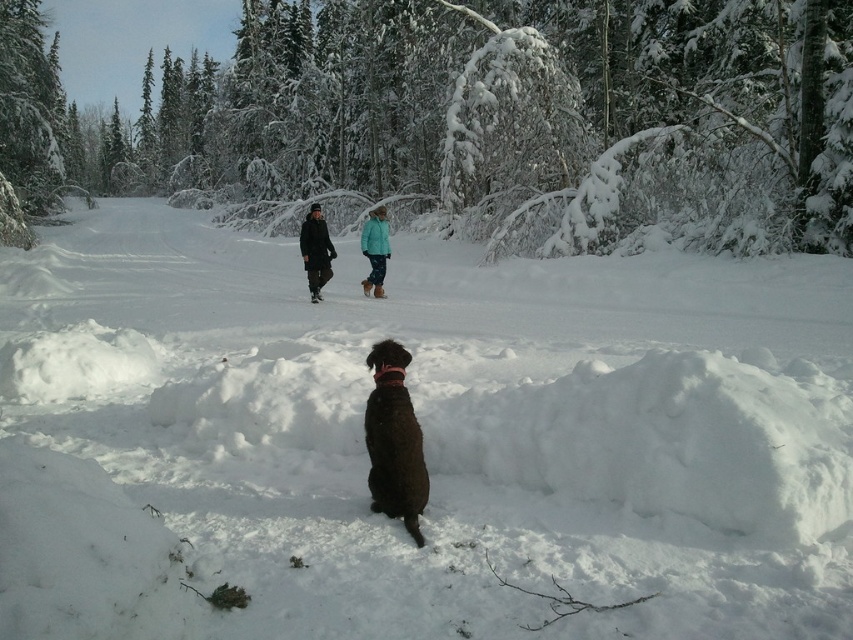
Looking at this image, you are planning to build a snowman using the white fluffy snow at center and the dark brown coat at center. Which object can you use to make the snowman?

The white fluffy snow at center can be used to make the snowman since it is bigger than the dark brown coat at center, and snow is a suitable material for building a snowman.

You are a hiker trying to follow the two figures walking away from you on the snow path. The white fluffy snow at center and the teal fabric jacket at center are in your line of sight. Which object is closer to you?

The white fluffy snow at center is closer to you because it is in front of the teal fabric jacket at center.